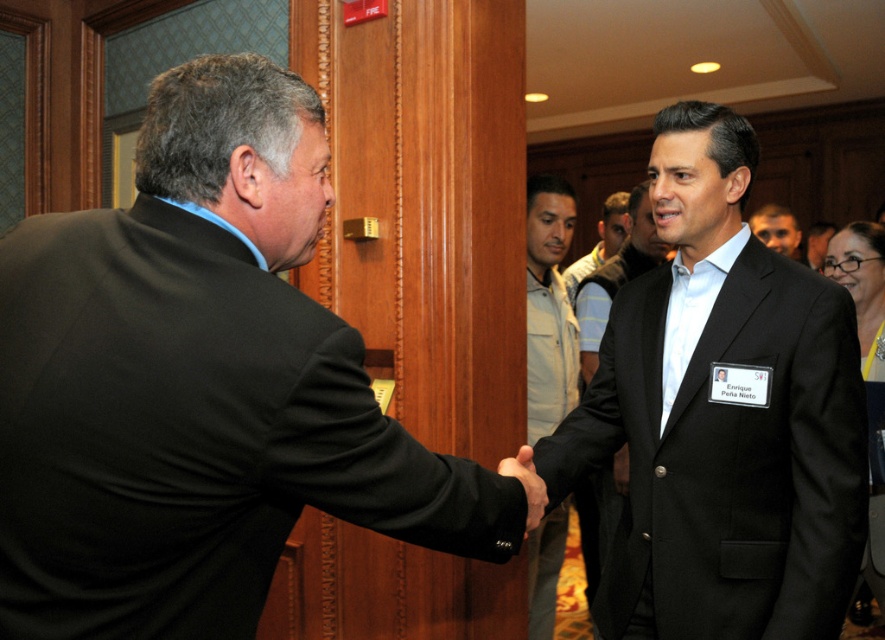
Looking at this image, is black suit at center below light brown leather jacket at center?

Correct, black suit at center is located below light brown leather jacket at center.

Consider the image. Can you confirm if black suit at center is bigger than light brown leather jacket at center?

No, black suit at center is not bigger than light brown leather jacket at center.

Where is `black suit at center`? This screenshot has width=885, height=640. black suit at center is located at coordinates (722, 417).

Is light beige jacket at center to the right of light blue shirt at center from the viewer's perspective?

In fact, light beige jacket at center is to the left of light blue shirt at center.

From the picture: Can you confirm if light beige jacket at center is thinner than light blue shirt at center?

Yes.

Find the location of `light beige jacket at center`. light beige jacket at center is located at coordinates (549, 307).

Locate an element on the screen. The width and height of the screenshot is (885, 640). light beige jacket at center is located at coordinates (549, 307).

Is black suit jacket at center below smooth black suit at center?

Yes.

Image resolution: width=885 pixels, height=640 pixels. I want to click on black suit jacket at center, so click(614, 276).

This screenshot has height=640, width=885. Identify the location of black suit jacket at center. (614, 276).

Where is `black suit jacket at center`? Image resolution: width=885 pixels, height=640 pixels. black suit jacket at center is located at coordinates (614, 276).